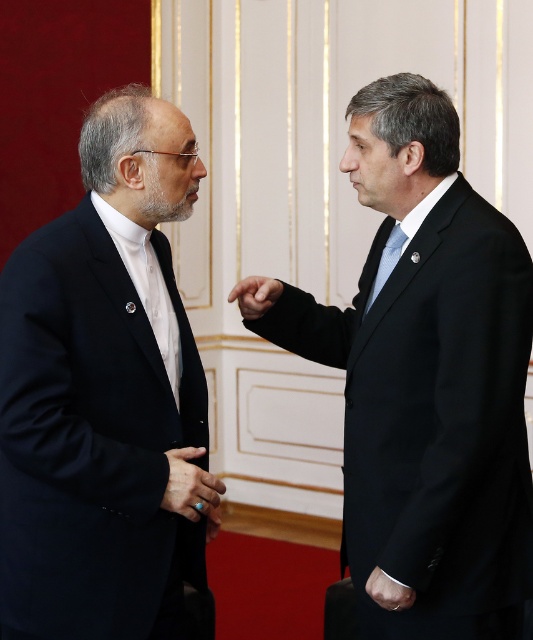
Measure the distance from smooth skin hand at center to blue silk tie at right.

smooth skin hand at center and blue silk tie at right are 12.17 inches apart from each other.

This screenshot has width=533, height=640. Describe the element at coordinates (255, 296) in the screenshot. I see `smooth skin hand at center` at that location.

You are a GUI agent. You are given a task and a screenshot of the screen. Output one action in this format:
    pyautogui.click(x=<x>, y=<y>)
    Task: Click on the smooth skin hand at center
    
    Given the screenshot: What is the action you would take?
    pyautogui.click(x=255, y=296)

Between matte black suit at left and blue silk tie at right, which one has less height?

blue silk tie at right is shorter.

You are a GUI agent. You are given a task and a screenshot of the screen. Output one action in this format:
    pyautogui.click(x=<x>, y=<y>)
    Task: Click on the matte black suit at left
    
    Given the screenshot: What is the action you would take?
    pyautogui.click(x=101, y=394)

Between point (127, 452) and point (383, 248), which one is positioned in front?

Point (127, 452) is more forward.

This screenshot has height=640, width=533. I want to click on matte black suit at left, so click(x=101, y=394).

Is point (426, 228) positioned behind point (146, 93)?

No, (426, 228) is closer to viewer.

Image resolution: width=533 pixels, height=640 pixels. Identify the location of black matte suit at right. (427, 380).